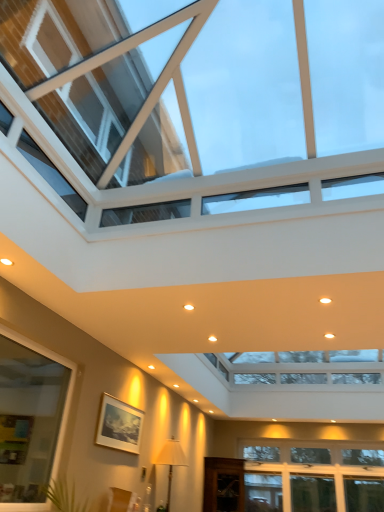
Question: Is transparent glass window at upper center, which ranks as the first window in top-to-bottom order, touching white fabric lampshade at lower center?

Choices:
 (A) yes
 (B) no

Answer: (B)

Question: Considering the relative sizes of transparent glass window at upper center, which ranks as the first window in top-to-bottom order, and white fabric lampshade at lower center in the image provided, is transparent glass window at upper center, which ranks as the first window in top-to-bottom order, bigger than white fabric lampshade at lower center?

Choices:
 (A) yes
 (B) no

Answer: (A)

Question: Does transparent glass window at upper center, which ranks as the first window in top-to-bottom order, appear on the right side of white fabric lampshade at lower center?

Choices:
 (A) yes
 (B) no

Answer: (A)

Question: Is transparent glass window at upper center, placed as the 3th window when sorted from bottom to top, not within white fabric lampshade at lower center?

Choices:
 (A) no
 (B) yes

Answer: (B)

Question: Is transparent glass window at upper center, placed as the 3th window when sorted from bottom to top, aimed at white fabric lampshade at lower center?

Choices:
 (A) yes
 (B) no

Answer: (B)

Question: Does point (342, 472) appear closer or farther from the camera than point (160, 451)?

Choices:
 (A) closer
 (B) farther

Answer: (B)

Question: In the image, is white glass window at lower right, the 1th window when ordered from bottom to top, on the left side or the right side of white fabric lampshade at lower center?

Choices:
 (A) right
 (B) left

Answer: (A)

Question: From a real-world perspective, relative to white fabric lampshade at lower center, is white glass window at lower right, the 1th window when ordered from bottom to top, vertically above or below?

Choices:
 (A) above
 (B) below

Answer: (A)

Question: Would you say white glass window at lower right, which ranks as the third window in top-to-bottom order, is inside or outside white fabric lampshade at lower center?

Choices:
 (A) inside
 (B) outside

Answer: (B)

Question: From the image's perspective, relative to transparent wooden cabinet at lower center, is clear glass window at lower left, the 2th window when ordered from bottom to top, above or below?

Choices:
 (A) below
 (B) above

Answer: (B)

Question: Is clear glass window at lower left, the 2th window from the top, situated inside transparent wooden cabinet at lower center or outside?

Choices:
 (A) inside
 (B) outside

Answer: (B)

Question: Looking at their shapes, would you say clear glass window at lower left, the 2th window when ordered from bottom to top, is wider or thinner than transparent wooden cabinet at lower center?

Choices:
 (A) thin
 (B) wide

Answer: (A)

Question: Is clear glass window at lower left, the 2th window when ordered from bottom to top, to the left or to the right of transparent wooden cabinet at lower center in the image?

Choices:
 (A) right
 (B) left

Answer: (B)

Question: Does point (1, 476) appear closer or farther from the camera than point (225, 179)?

Choices:
 (A) farther
 (B) closer

Answer: (A)

Question: Considering the relative positions of clear glass window at lower left, the 2th window from the top, and transparent glass window at upper center, placed as the 3th window when sorted from bottom to top, in the image provided, is clear glass window at lower left, the 2th window from the top, to the left or to the right of transparent glass window at upper center, placed as the 3th window when sorted from bottom to top,?

Choices:
 (A) left
 (B) right

Answer: (A)